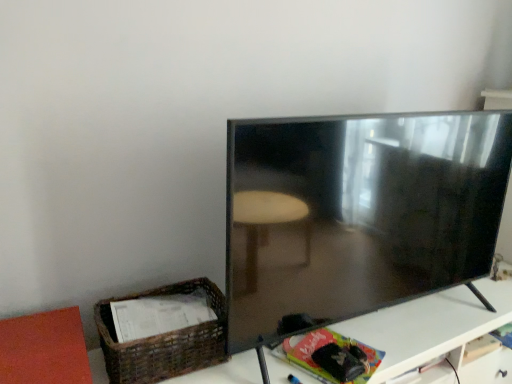
Where is `vacant location below matte black tv at right (from a real-world perspective)`? The width and height of the screenshot is (512, 384). vacant location below matte black tv at right (from a real-world perspective) is located at coordinates (406, 319).